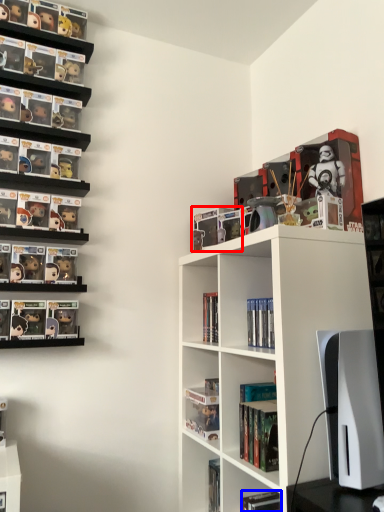
Question: Which point is further to the camera, book (highlighted by a red box) or book (highlighted by a blue box)?

Choices:
 (A) book
 (B) book

Answer: (A)